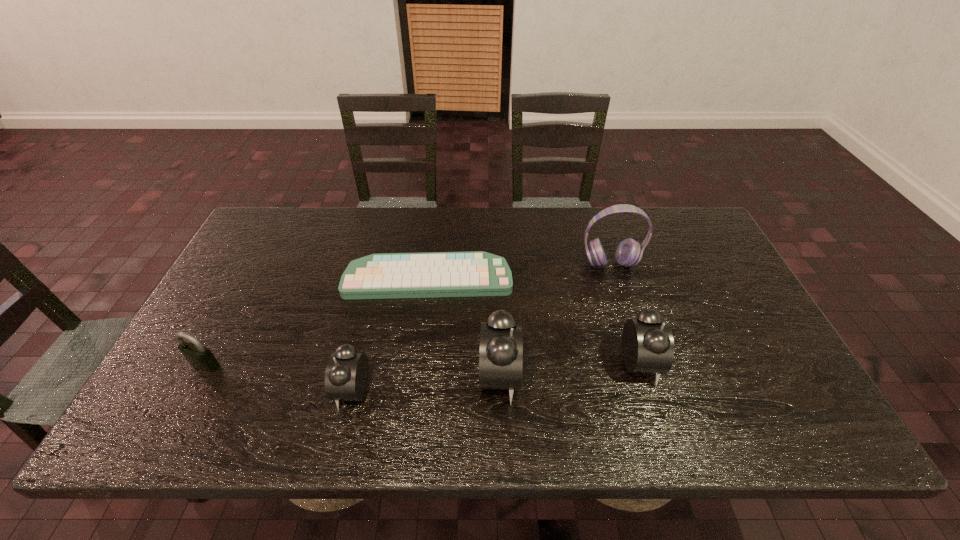
This screenshot has height=540, width=960. In the image, there is a desktop. Identify the location of free space at the left edge. (249, 312).

Where is `free space at the right edge`? This screenshot has width=960, height=540. free space at the right edge is located at coordinates (694, 280).

Locate an element on the screen. vacant space at the far left corner is located at coordinates (300, 223).

In the image, there is a desktop. Where is `free region at the far right corner`? This screenshot has width=960, height=540. free region at the far right corner is located at coordinates 697,227.

The height and width of the screenshot is (540, 960). Identify the location of free spot between the leftmost alarm clock and the shortest object. (391, 334).

The height and width of the screenshot is (540, 960). I want to click on empty space between the headset and the leftmost object, so pos(408,314).

Locate an element on the screen. vacant space that's between the shortest alarm clock and the shortest object is located at coordinates (391, 334).

Image resolution: width=960 pixels, height=540 pixels. In order to click on free spot between the second shortest alarm clock and the shortest object in this screenshot , I will do `click(534, 321)`.

The width and height of the screenshot is (960, 540). In order to click on unoccupied area between the padlock and the second shortest alarm clock in this screenshot , I will do `click(422, 364)`.

Locate an element on the screen. This screenshot has width=960, height=540. object that is the fifth nearest to the rightmost alarm clock is located at coordinates (200, 357).